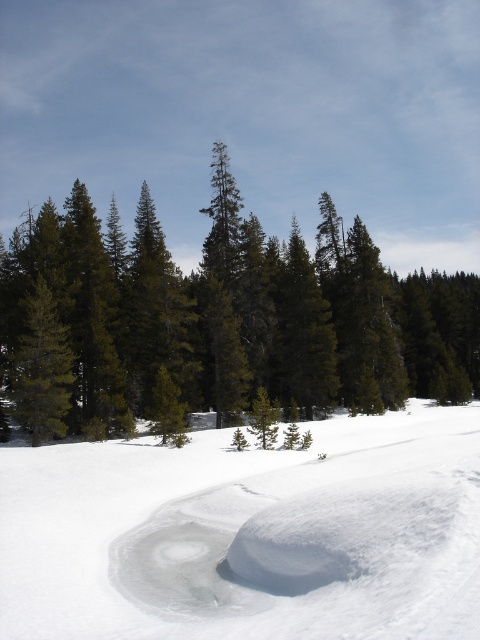
Does white snow at center have a greater height compared to green matte tree at left?

In fact, white snow at center may be shorter than green matte tree at left.

What do you see at coordinates (248, 532) in the screenshot? The height and width of the screenshot is (640, 480). I see `white snow at center` at bounding box center [248, 532].

Who is more distant from viewer, (6,566) or (64,342)?

The point (64,342) is behind.

Identify the location of white snow at center. (248, 532).

Is point (340, 513) positioned behind point (286, 246)?

No, (340, 513) is in front of (286, 246).

I want to click on white snow at center, so click(248, 532).

Does point (340, 394) come closer to viewer compared to point (70, 372)?

No, it is behind (70, 372).

In the scene shown: How far apart are green matte tree at center and green matte tree at left?

The distance of green matte tree at center from green matte tree at left is 16.36 meters.

Between point (152, 396) and point (50, 305), which one is positioned behind?

The point (152, 396) is more distant.

At what (x,y) coordinates should I click in order to perform the action: click on green matte tree at center. Please return your answer as a coordinate pair (x, y). This screenshot has height=640, width=480. Looking at the image, I should click on (218, 320).